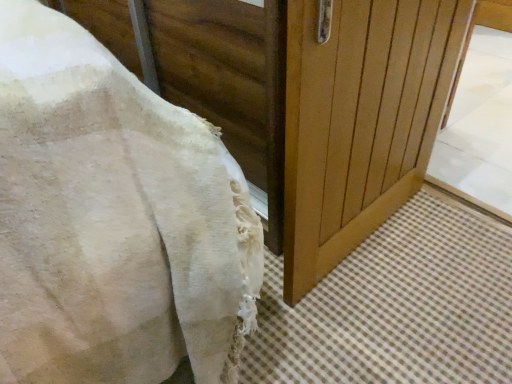
I want to click on white textured fabric at upper left, so click(x=110, y=217).

What do you see at coordinates (110, 217) in the screenshot?
I see `white textured fabric at upper left` at bounding box center [110, 217].

The width and height of the screenshot is (512, 384). Identify the location of white textured fabric at upper left. (110, 217).